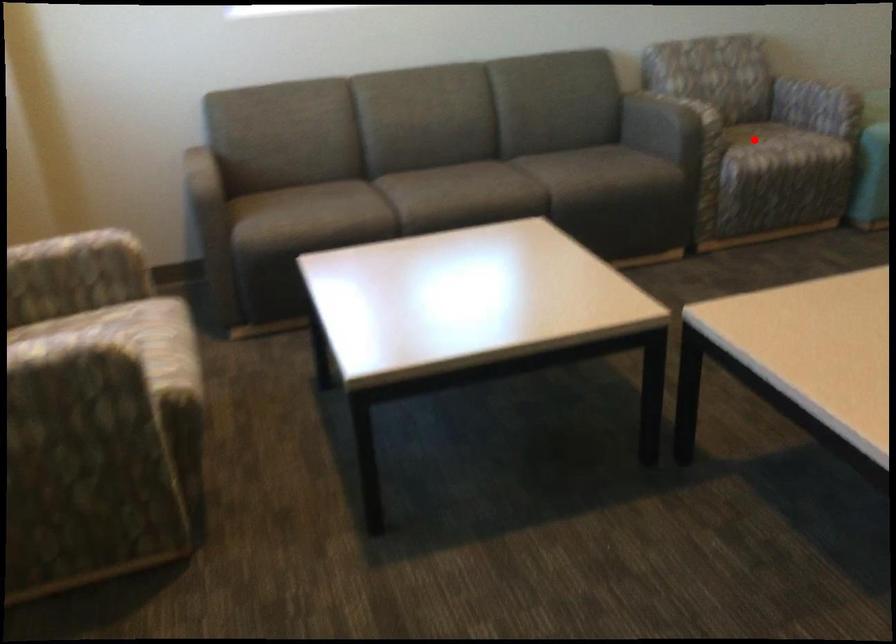
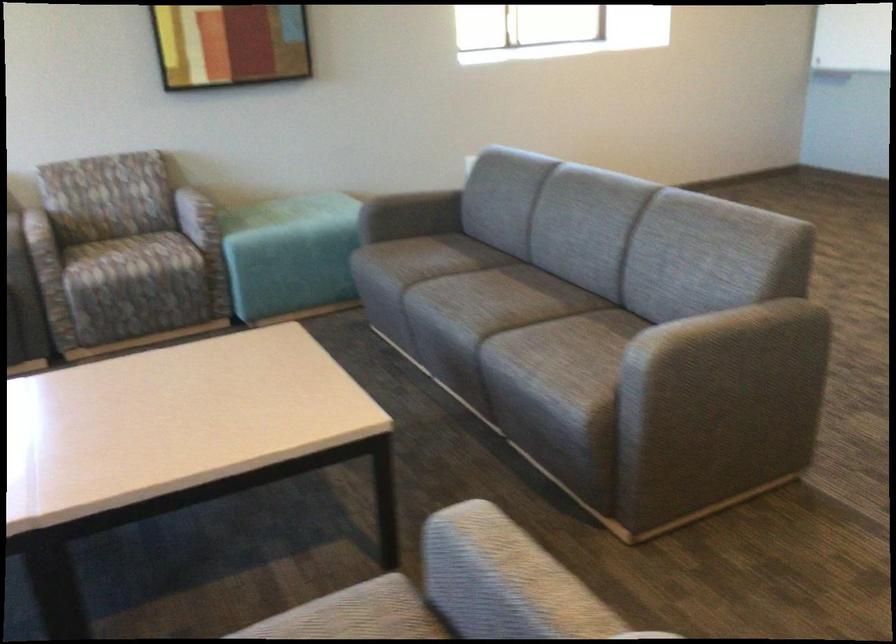
Locate, in the second image, the point that corresponds to the highlighted location in the first image.

(125, 259)